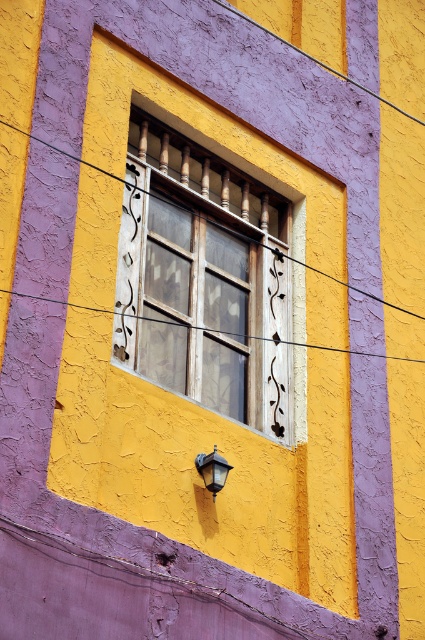
Consider the image. Between transparent glass window at center and matte black lamp at lower center, which one is positioned higher?

→ transparent glass window at center is higher up.

How distant is transparent glass window at center from matte black lamp at lower center?

A distance of 21.24 feet exists between transparent glass window at center and matte black lamp at lower center.

Is point (150, 368) farther from viewer compared to point (215, 467)?

Yes, it is behind point (215, 467).

Identify the location of transparent glass window at center. The height and width of the screenshot is (640, 425). (204, 278).